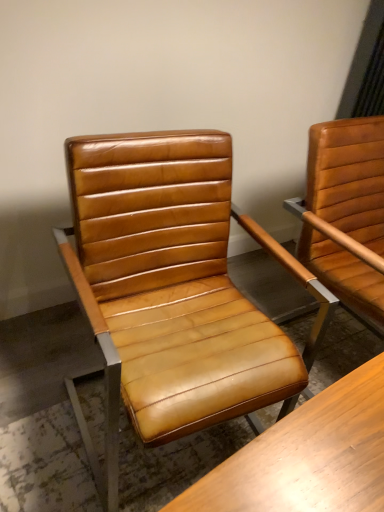
In order to face matte brown leather chair at center, should I rotate leftwards or rightwards?

Rotate left and turn 1.648 degrees.

Where is `matte brown leather chair at center`? Image resolution: width=384 pixels, height=512 pixels. matte brown leather chair at center is located at coordinates (173, 291).

The height and width of the screenshot is (512, 384). Describe the element at coordinates (173, 291) in the screenshot. I see `matte brown leather chair at center` at that location.

Where is `matte brown leather chair at center`? The image size is (384, 512). matte brown leather chair at center is located at coordinates (173, 291).